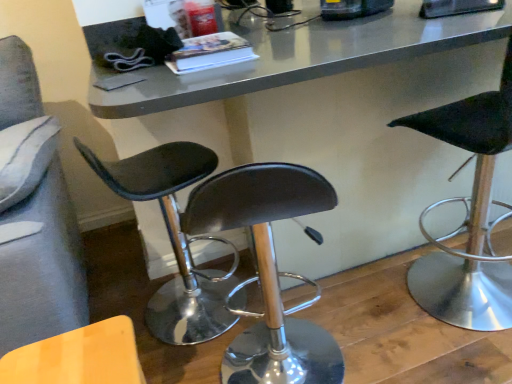
Question: Is point (440, 314) positioned closer to the camera than point (411, 269)?

Choices:
 (A) farther
 (B) closer

Answer: (B)

Question: In the image, is black leather stool at right, the 1th chair viewed from the right, positioned in front of or behind metallic gray table at center?

Choices:
 (A) behind
 (B) front

Answer: (B)

Question: Which object is positioned farthest from the black leather stool at right, the 1th chair viewed from the right?

Choices:
 (A) metallic gray table at center
 (B) wooden textured chair at lower left, the 3th chair when ordered from right to left
 (C) black leather stool at center, which ranks as the 2th chair in right-to-left order

Answer: (B)

Question: Estimate the real-world distances between objects in this image. Which object is closer to the black leather stool at right, the third chair from the left?

Choices:
 (A) metallic gray table at center
 (B) wooden textured chair at lower left, the first chair positioned from the left
 (C) black leather stool at center, which ranks as the 2th chair in right-to-left order

Answer: (A)